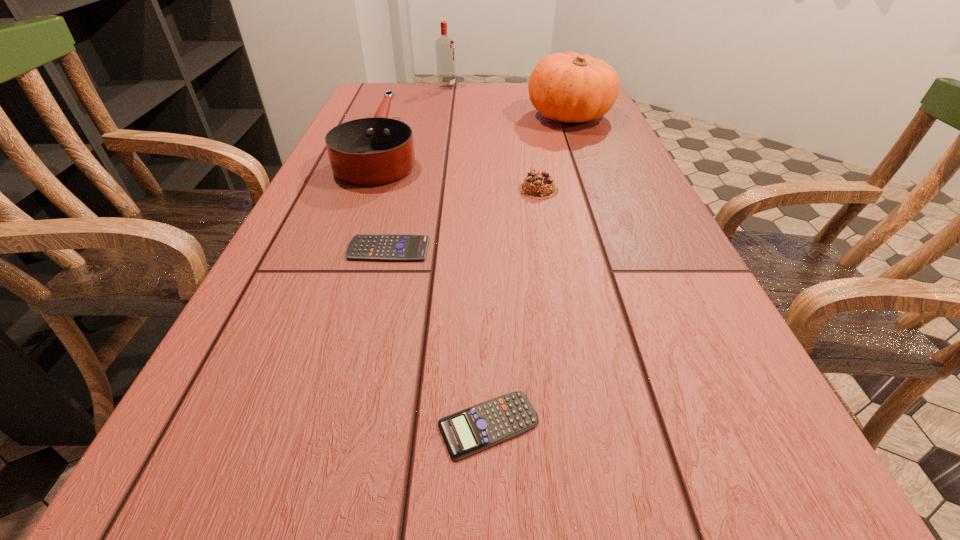
Where is `vodka`? vodka is located at coordinates (444, 46).

The width and height of the screenshot is (960, 540). Find the location of `the tallest object`. the tallest object is located at coordinates (444, 46).

The height and width of the screenshot is (540, 960). In order to click on the second tallest object in this screenshot , I will do `click(568, 87)`.

What are the coordinates of `pan` in the screenshot? It's located at (371, 151).

This screenshot has width=960, height=540. What are the coordinates of `the fourth tallest object` in the screenshot? It's located at (538, 185).

I want to click on the farther calculator, so point(395,247).

Where is `the second nearest object`? Image resolution: width=960 pixels, height=540 pixels. the second nearest object is located at coordinates (395, 247).

Identify the location of the third object from right to left. This screenshot has width=960, height=540. (466, 432).

Identify the location of the right calculator. click(x=466, y=432).

Locate an element on the screen. The height and width of the screenshot is (540, 960). vacant space located 0.380m on the front label of the farthest object is located at coordinates (570, 87).